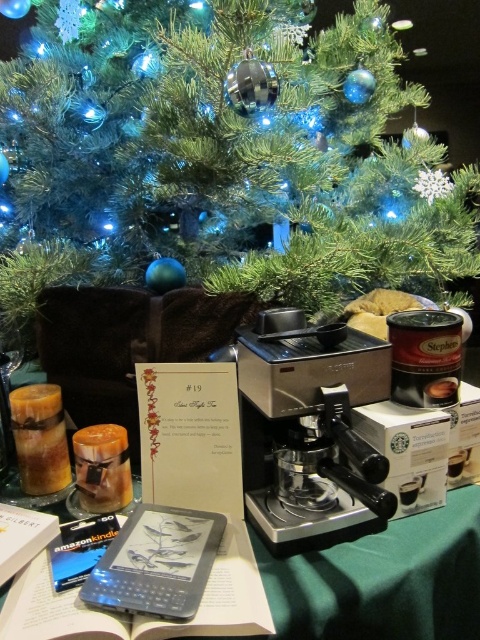
Question: Does sleek metallic coffee machine at center have a greater width compared to green matte christmas tree at upper center?

Choices:
 (A) yes
 (B) no

Answer: (B)

Question: Does metallic silver espresso machine at center appear over green matte christmas tree at upper center?

Choices:
 (A) yes
 (B) no

Answer: (B)

Question: Which object is closer to the camera taking this photo?

Choices:
 (A) green matte christmas tree at upper center
 (B) metallic silver espresso machine at center
 (C) sleek metallic coffee machine at center
 (D) hardcover book at center

Answer: (D)

Question: Based on their relative distances, which object is farther from the hardcover book at center?

Choices:
 (A) sleek metallic coffee machine at center
 (B) metallic silver espresso machine at center

Answer: (A)

Question: Based on their relative distances, which object is nearer to the metallic silver espresso machine at center?

Choices:
 (A) hardcover book at center
 (B) sleek metallic coffee machine at center

Answer: (A)

Question: Can you confirm if hardcover book at center is thinner than green matte christmas tree at upper center?

Choices:
 (A) no
 (B) yes

Answer: (B)